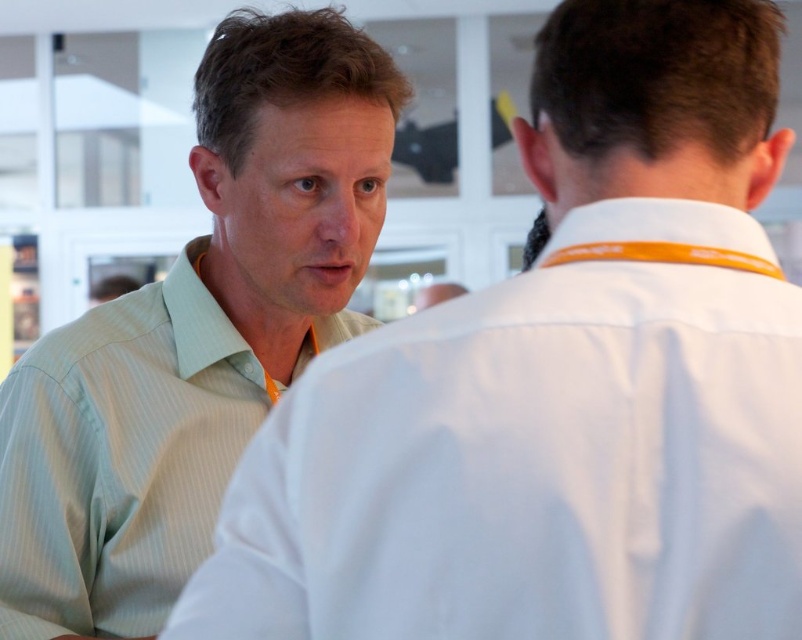
You are a photographer standing at point (256, 131). You need to take a photo of both individuals. The camera has a maximum focus range of 1.5 meters. Can you capture both people in focus without moving?

The two individuals are 1.80 meters apart. Since the camera can only focus up to 1.5 meters, it won not be able to capture both in focus without moving.

You are standing in a professional setting and see the point marked at coordinates (196,333). Which object does this point correspond to?

The point at coordinates (196,333) corresponds to the light green striped shirt at left.